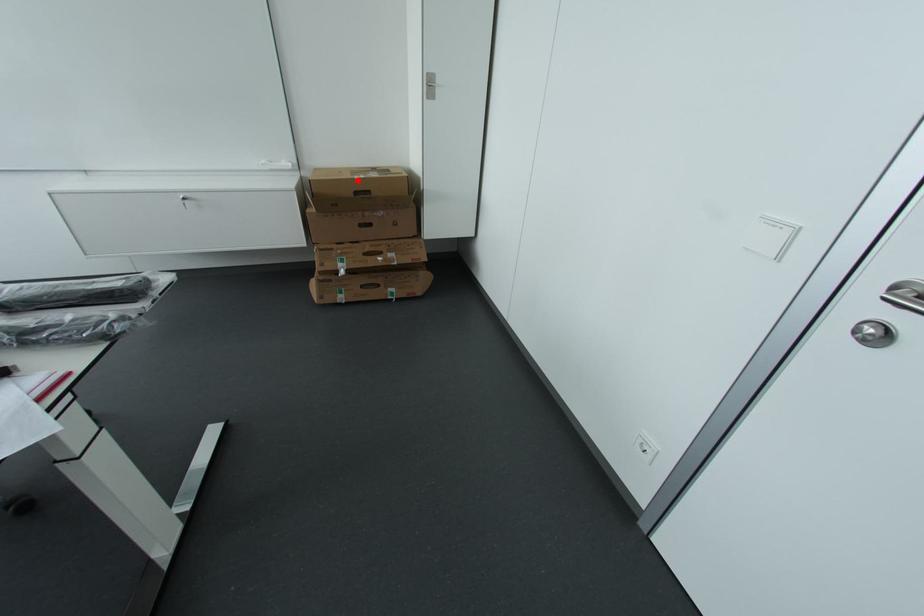
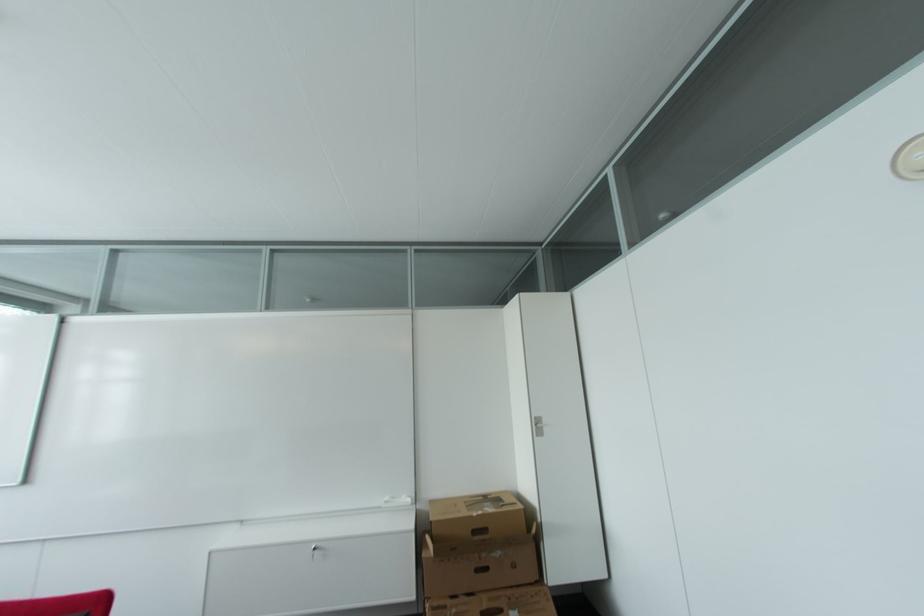
In the second image, find the point that corresponds to the highlighted location in the first image.

(476, 517)